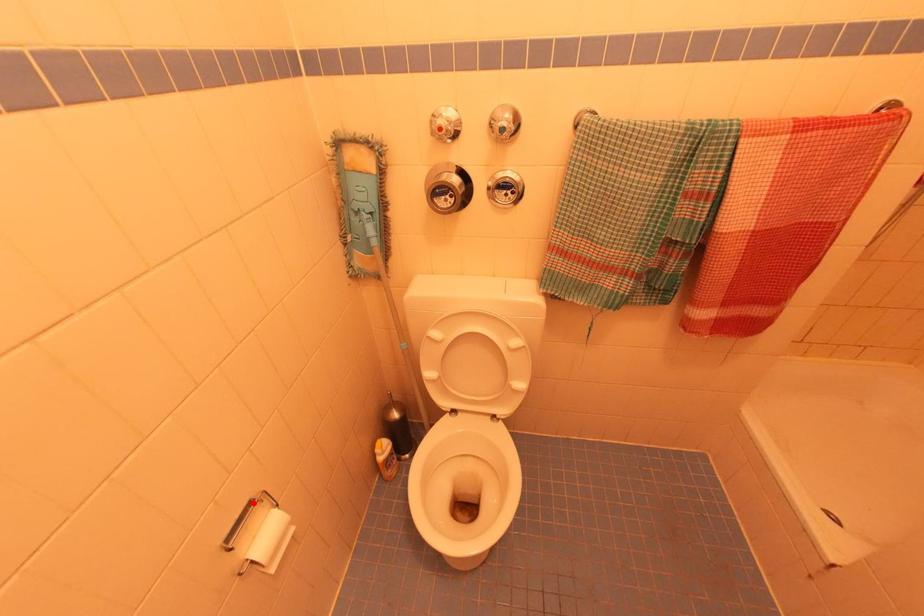
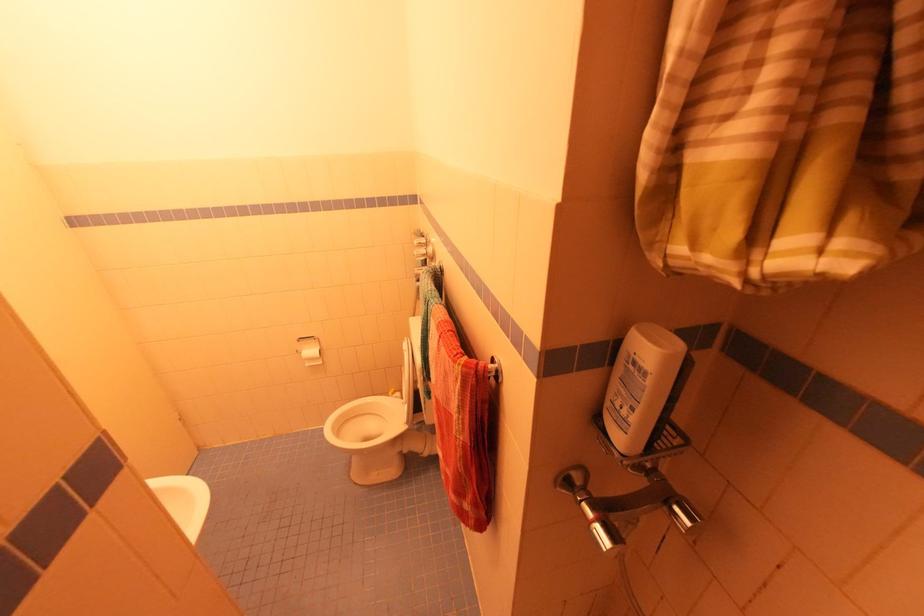
Locate, in the second image, the point that corresponds to the highlighted location in the first image.

(314, 338)